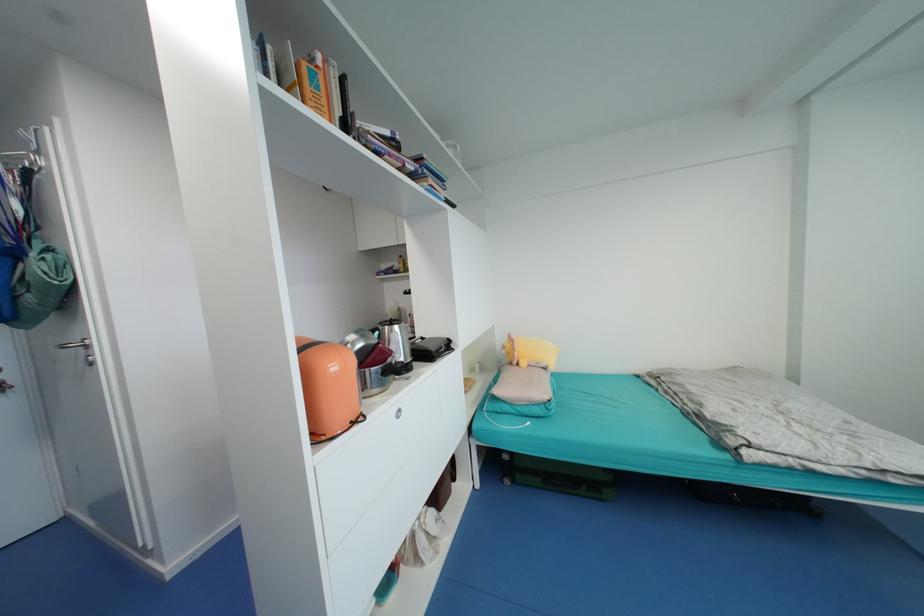
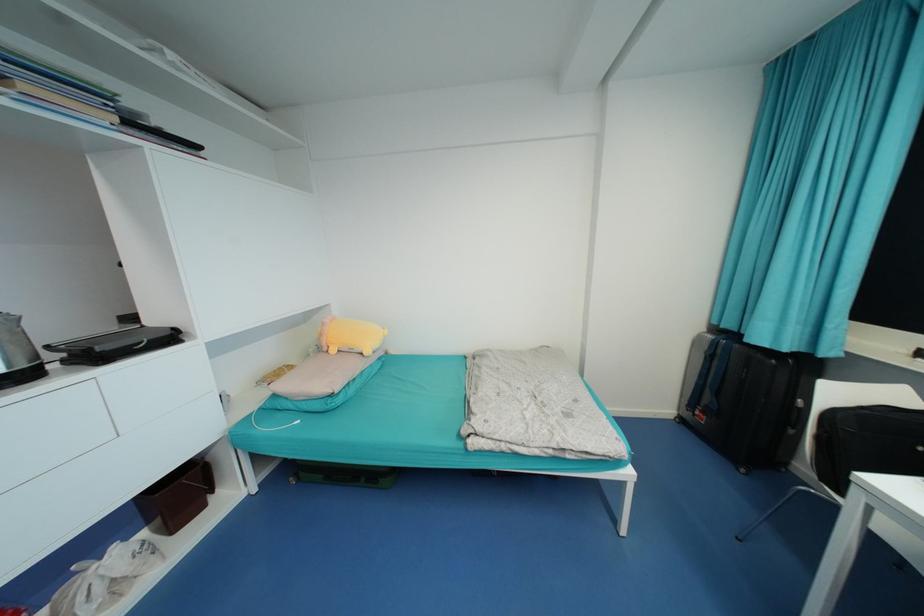
Where in the second image is the point corresponding to pixel 412 360 from the first image?

(30, 367)